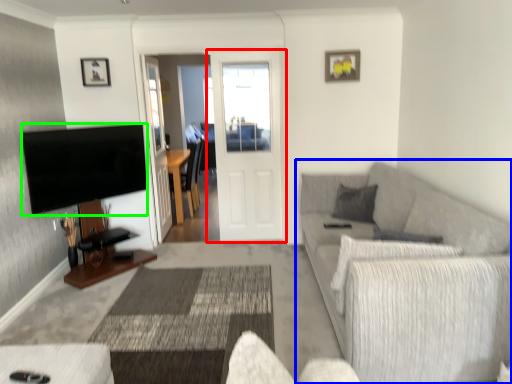
Question: Based on their relative distances, which object is farther from door (highlighted by a red box)? Choose from studio couch (highlighted by a blue box) and television (highlighted by a green box).

Choices:
 (A) studio couch
 (B) television

Answer: (A)